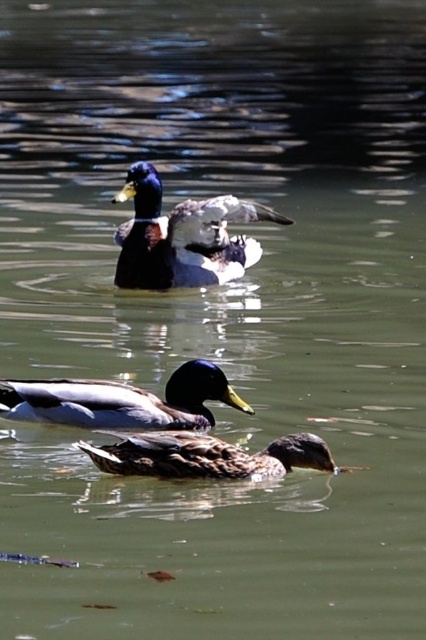
Looking at this image, can you confirm if shiny brown duck at center is smaller than brown matte duck at lower center?

Yes.

Does shiny brown duck at center have a lesser height compared to brown matte duck at lower center?

In fact, shiny brown duck at center may be taller than brown matte duck at lower center.

Does point (25, 419) lie in front of point (189, 445)?

No, (25, 419) is further to viewer.

Where is `shiny brown duck at center`? This screenshot has width=426, height=640. shiny brown duck at center is located at coordinates (121, 401).

Which is behind, point (118, 234) or point (216, 381)?

Point (118, 234)

Is point (190, 250) farther from camera compared to point (115, 392)?

Yes, it is.

The width and height of the screenshot is (426, 640). Describe the element at coordinates (183, 236) in the screenshot. I see `shiny green drake at upper center` at that location.

This screenshot has width=426, height=640. Find the location of `shiny green drake at upper center`. shiny green drake at upper center is located at coordinates (183, 236).

Which is below, shiny green drake at upper center or brown matte duck at lower center?

brown matte duck at lower center is below.

Does point (207, 232) lie in front of point (120, 468)?

That is False.

Image resolution: width=426 pixels, height=640 pixels. I want to click on shiny green drake at upper center, so click(183, 236).